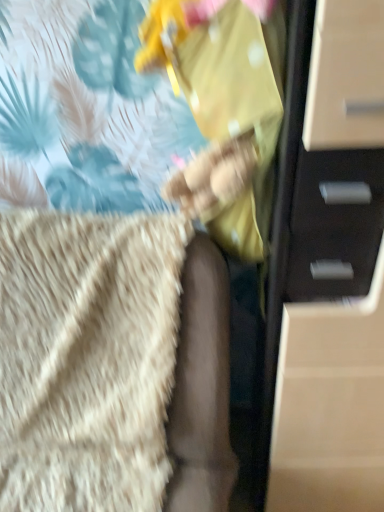
Question: Does matte black chest of drawers at right appear on the right side of beige fluffy blanket at lower left?

Choices:
 (A) yes
 (B) no

Answer: (A)

Question: Is matte black chest of drawers at right not close to beige fluffy blanket at lower left?

Choices:
 (A) yes
 (B) no

Answer: (B)

Question: Could you tell me if matte black chest of drawers at right is turned towards beige fluffy blanket at lower left?

Choices:
 (A) yes
 (B) no

Answer: (B)

Question: Considering the relative sizes of matte black chest of drawers at right and beige fluffy blanket at lower left in the image provided, is matte black chest of drawers at right taller than beige fluffy blanket at lower left?

Choices:
 (A) yes
 (B) no

Answer: (A)

Question: Is matte black chest of drawers at right smaller than beige fluffy blanket at lower left?

Choices:
 (A) no
 (B) yes

Answer: (B)

Question: Is matte black chest of drawers at right thinner than beige fluffy blanket at lower left?

Choices:
 (A) no
 (B) yes

Answer: (B)

Question: Is matte black chest of drawers at right at the back of beige fluffy blanket at lower left?

Choices:
 (A) no
 (B) yes

Answer: (A)

Question: Does beige fluffy blanket at lower left have a lesser height compared to matte black chest of drawers at right?

Choices:
 (A) no
 (B) yes

Answer: (B)

Question: Is beige fluffy blanket at lower left not near matte black chest of drawers at right?

Choices:
 (A) yes
 (B) no

Answer: (B)

Question: Can you confirm if beige fluffy blanket at lower left is positioned to the right of matte black chest of drawers at right?

Choices:
 (A) no
 (B) yes

Answer: (A)

Question: Is beige fluffy blanket at lower left touching matte black chest of drawers at right?

Choices:
 (A) no
 (B) yes

Answer: (A)

Question: Considering the relative sizes of beige fluffy blanket at lower left and matte black chest of drawers at right in the image provided, is beige fluffy blanket at lower left thinner than matte black chest of drawers at right?

Choices:
 (A) yes
 (B) no

Answer: (B)

Question: Considering the positions of point (292, 287) and point (23, 366), is point (292, 287) closer or farther from the camera than point (23, 366)?

Choices:
 (A) closer
 (B) farther

Answer: (A)